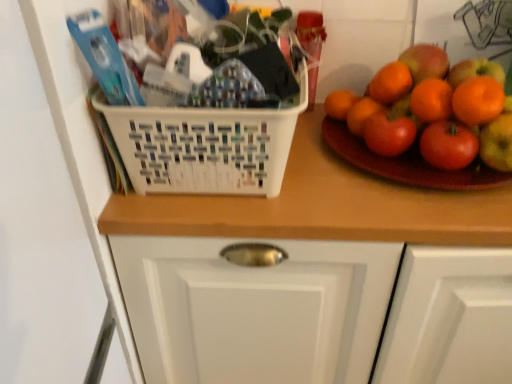
I want to click on free spot below glossy wooden plate at right (from a real-world perspective), so click(399, 153).